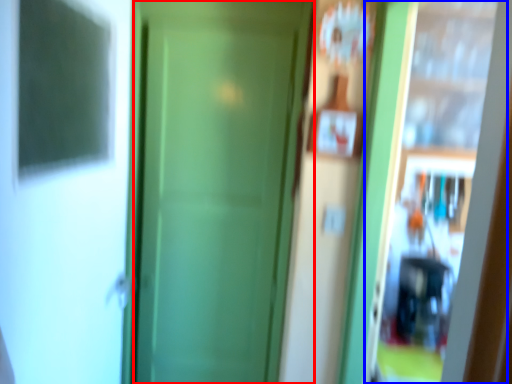
Question: Which point is closer to the camera, door (highlighted by a red box) or screen door (highlighted by a blue box)?

Choices:
 (A) door
 (B) screen door

Answer: (B)